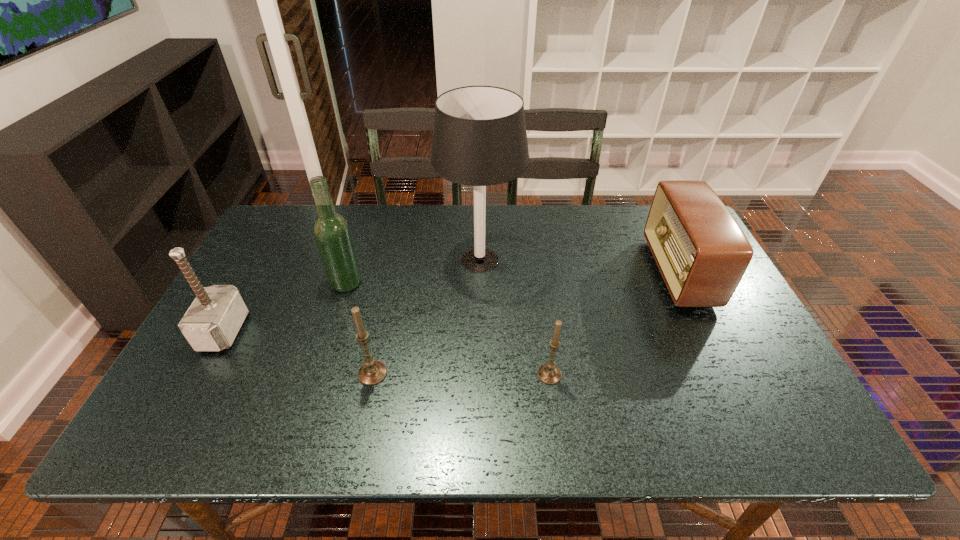
Locate an element on the screen. blank space at the near right corner of the desktop is located at coordinates (769, 384).

This screenshot has height=540, width=960. I want to click on empty space between the liquor and the fifth object from left to right, so click(447, 329).

Find the location of a particular element. This screenshot has height=540, width=960. unoccupied area between the fourth object from left to right and the fourth shortest object is located at coordinates (351, 295).

Where is `free space between the table lamp and the second object from left to right`? The image size is (960, 540). free space between the table lamp and the second object from left to right is located at coordinates (413, 271).

The image size is (960, 540). What are the coordinates of `free space between the shorter candle and the liquor` in the screenshot? It's located at (447, 329).

This screenshot has width=960, height=540. Identify the location of free space between the radio receiver and the fourth shortest object. (451, 302).

Locate an element on the screen. The image size is (960, 540). unoccupied position between the third object from left to right and the second object from right to left is located at coordinates (461, 374).

Locate an element on the screen. Image resolution: width=960 pixels, height=540 pixels. vacant area that lies between the fourth shortest object and the radio receiver is located at coordinates (451, 302).

Identify the location of free space between the rightmost object and the fourth object from right to left. The width and height of the screenshot is (960, 540). (525, 323).

Locate an element on the screen. This screenshot has height=540, width=960. empty location between the shortest object and the leftmost object is located at coordinates (387, 353).